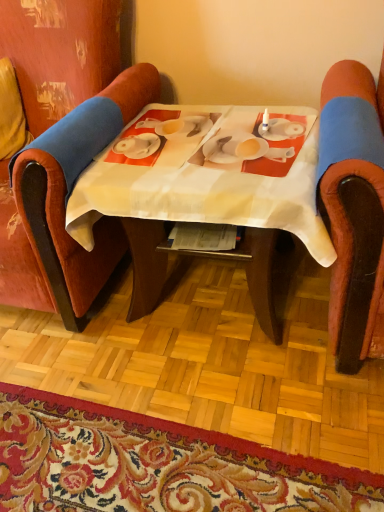
Describe the element at coordinates (354, 209) in the screenshot. I see `velvet-like orange chair at right, which is the first chair in right-to-left order` at that location.

Find the location of a particular element. The width and height of the screenshot is (384, 512). velvet red chair at left, which is the first chair in left-to-right order is located at coordinates (62, 237).

From the image's perspective, is white fabric table at center located above or below velvet-like orange chair at right, the second chair viewed from the left?

white fabric table at center is situated lower than velvet-like orange chair at right, the second chair viewed from the left, in the image.

Looking at this image, could you tell me if white fabric table at center is turned towards velvet-like orange chair at right, the second chair viewed from the left?

No, white fabric table at center is not facing towards velvet-like orange chair at right, the second chair viewed from the left.

Where is `the 2nd chair in front of the white fabric table at center`? This screenshot has width=384, height=512. the 2nd chair in front of the white fabric table at center is located at coordinates (354, 209).

From a real-world perspective, which is physically above, white fabric table at center or velvet-like orange chair at right, the second chair viewed from the left?

velvet-like orange chair at right, the second chair viewed from the left, is physically above.

Between carpet with floral pattern at lower center and velvet-like orange chair at right, the second chair viewed from the left, which one is positioned in front?

velvet-like orange chair at right, the second chair viewed from the left.

From the picture: Choose the correct answer: Is carpet with floral pattern at lower center inside velvet-like orange chair at right, which is the first chair in right-to-left order, or outside it?

carpet with floral pattern at lower center is not enclosed by velvet-like orange chair at right, which is the first chair in right-to-left order.

From a real-world perspective, is carpet with floral pattern at lower center positioned above or below velvet-like orange chair at right, which is the first chair in right-to-left order?

carpet with floral pattern at lower center is below velvet-like orange chair at right, which is the first chair in right-to-left order.

Does carpet with floral pattern at lower center have a greater width compared to velvet-like orange chair at right, the second chair viewed from the left?

Yes.

Considering the relative positions of velvet-like orange chair at right, the second chair viewed from the left, and velvet red chair at left, which is the first chair in left-to-right order, in the image provided, is velvet-like orange chair at right, the second chair viewed from the left, to the left of velvet red chair at left, which is the first chair in left-to-right order, from the viewer's perspective?

No, velvet-like orange chair at right, the second chair viewed from the left, is not to the left of velvet red chair at left, which is the first chair in left-to-right order.

Is velvet-like orange chair at right, which is the first chair in right-to-left order, positioned beyond the bounds of velvet red chair at left, which is the first chair in left-to-right order?

Yes.

You are a GUI agent. You are given a task and a screenshot of the screen. Output one action in this format:
    pyautogui.click(x=<x>, y=<y>)
    Task: Click on the chair on the right of velvet red chair at left, acting as the second chair starting from the right
    This screenshot has width=384, height=512.
    Given the screenshot: What is the action you would take?
    pyautogui.click(x=354, y=209)

From the picture: Can you confirm if velvet-like orange chair at right, which is the first chair in right-to-left order, is bigger than velvet red chair at left, which is the first chair in left-to-right order?

Incorrect, velvet-like orange chair at right, which is the first chair in right-to-left order, is not larger than velvet red chair at left, which is the first chair in left-to-right order.

Does velvet-like orange chair at right, which is the first chair in right-to-left order, come in front of white fabric table at center?

Yes, velvet-like orange chair at right, which is the first chair in right-to-left order, is closer to the viewer.

Between point (361, 112) and point (158, 136), which one is positioned behind?

The point (158, 136) is more distant.

Considering the sizes of velvet-like orange chair at right, which is the first chair in right-to-left order, and white fabric table at center in the image, is velvet-like orange chair at right, which is the first chair in right-to-left order, bigger or smaller than white fabric table at center?

Considering their sizes, velvet-like orange chair at right, which is the first chair in right-to-left order, takes up more space than white fabric table at center.

Considering the sizes of objects white fabric table at center and velvet red chair at left, which is the first chair in left-to-right order, in the image provided, who is shorter, white fabric table at center or velvet red chair at left, which is the first chair in left-to-right order,?

Standing shorter between the two is white fabric table at center.

From a real-world perspective, between white fabric table at center and velvet red chair at left, acting as the second chair starting from the right, who is vertically lower?

white fabric table at center.

In terms of width, does white fabric table at center look wider or thinner when compared to velvet red chair at left, acting as the second chair starting from the right?

Clearly, white fabric table at center has less width compared to velvet red chair at left, acting as the second chair starting from the right.

From a real-world perspective, is white fabric table at center beneath carpet with floral pattern at lower center?

Actually, white fabric table at center is physically above carpet with floral pattern at lower center in the real world.

Considering the relative positions of white fabric table at center and carpet with floral pattern at lower center in the image provided, is white fabric table at center behind carpet with floral pattern at lower center?

That is True.

Considering the relative sizes of white fabric table at center and carpet with floral pattern at lower center in the image provided, is white fabric table at center shorter than carpet with floral pattern at lower center?

In fact, white fabric table at center may be taller than carpet with floral pattern at lower center.

From the image's perspective, is white fabric table at center beneath carpet with floral pattern at lower center?

Incorrect, from the image's perspective, white fabric table at center is higher than carpet with floral pattern at lower center.

Consider the image. From a real-world perspective, is velvet red chair at left, which is the first chair in left-to-right order, under carpet with floral pattern at lower center?

Incorrect, from a real-world perspective, velvet red chair at left, which is the first chair in left-to-right order, is higher than carpet with floral pattern at lower center.

Which object is further away from the camera taking this photo, velvet red chair at left, which is the first chair in left-to-right order, or carpet with floral pattern at lower center?

Positioned behind is velvet red chair at left, which is the first chair in left-to-right order.

Which point is more forward, (52, 192) or (372, 482)?

The point (372, 482) is closer to the camera.

Consider the image. How many degrees apart are the facing directions of velvet red chair at left, acting as the second chair starting from the right, and carpet with floral pattern at lower center?

There is a 88.8-degree angle between the facing directions of velvet red chair at left, acting as the second chair starting from the right, and carpet with floral pattern at lower center.

From a real-world perspective, which chair is the 1st one above the white fabric table at center? Please provide its 2D coordinates.

[(354, 209)]

Locate an element on the screen. mat on the left side of velvet-like orange chair at right, which is the first chair in right-to-left order is located at coordinates (154, 464).

Based on their spatial positions, is carpet with floral pattern at lower center or white fabric table at center closer to velvet red chair at left, which is the first chair in left-to-right order?

white fabric table at center.

Which object lies further to the anchor point carpet with floral pattern at lower center, velvet-like orange chair at right, the second chair viewed from the left, or velvet red chair at left, which is the first chair in left-to-right order?

Based on the image, velvet-like orange chair at right, the second chair viewed from the left, appears to be further to carpet with floral pattern at lower center.

Which object lies further to the anchor point white fabric table at center, velvet red chair at left, which is the first chair in left-to-right order, or velvet-like orange chair at right, the second chair viewed from the left?

velvet red chair at left, which is the first chair in left-to-right order, is positioned further to the anchor white fabric table at center.

When comparing their distances from velvet red chair at left, which is the first chair in left-to-right order, does white fabric table at center or carpet with floral pattern at lower center seem further?

carpet with floral pattern at lower center lies further to velvet red chair at left, which is the first chair in left-to-right order, than the other object.

From the image, which object appears to be nearer to white fabric table at center, velvet-like orange chair at right, the second chair viewed from the left, or velvet red chair at left, acting as the second chair starting from the right?

velvet-like orange chair at right, the second chair viewed from the left, is closer to white fabric table at center.

Considering their positions, is velvet red chair at left, which is the first chair in left-to-right order, positioned closer to velvet-like orange chair at right, the second chair viewed from the left, than carpet with floral pattern at lower center?

carpet with floral pattern at lower center is positioned closer to the anchor velvet-like orange chair at right, the second chair viewed from the left.

Looking at the image, which one is located further to velvet red chair at left, acting as the second chair starting from the right, carpet with floral pattern at lower center or velvet-like orange chair at right, which is the first chair in right-to-left order?

velvet-like orange chair at right, which is the first chair in right-to-left order, is further to velvet red chair at left, acting as the second chair starting from the right.

When comparing their distances from carpet with floral pattern at lower center, does white fabric table at center or velvet-like orange chair at right, which is the first chair in right-to-left order, seem closer?

white fabric table at center is closer to carpet with floral pattern at lower center.

The image size is (384, 512). Identify the location of table between velvet-like orange chair at right, the second chair viewed from the left, and carpet with floral pattern at lower center in the up-down direction. (203, 192).

You are a GUI agent. You are given a task and a screenshot of the screen. Output one action in this format:
    pyautogui.click(x=<x>, y=<y>)
    Task: Click on the mat between velvet red chair at left, acting as the second chair starting from the right, and velvet-like orange chair at right, the second chair viewed from the left, from left to right
    The image size is (384, 512).
    Given the screenshot: What is the action you would take?
    pyautogui.click(x=154, y=464)

At what (x,y) coordinates should I click in order to perform the action: click on table situated between velvet red chair at left, which is the first chair in left-to-right order, and velvet-like orange chair at right, which is the first chair in right-to-left order, from left to right. Please return your answer as a coordinate pair (x, y). The height and width of the screenshot is (512, 384). Looking at the image, I should click on (203, 192).

In order to click on table between velvet red chair at left, acting as the second chair starting from the right, and carpet with floral pattern at lower center in the up-down direction in this screenshot , I will do `click(203, 192)`.